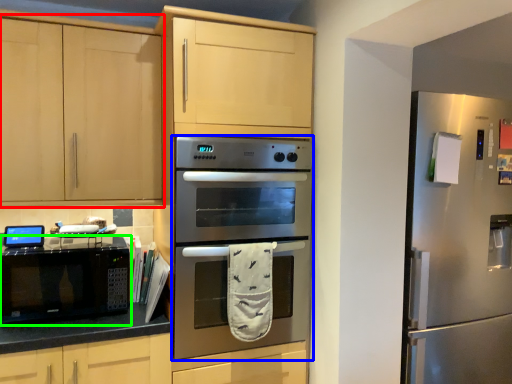
Question: Which object is positioned closest to cabinetry (highlighted by a red box)? Select from oven (highlighted by a blue box) and microwave oven (highlighted by a green box).

Choices:
 (A) oven
 (B) microwave oven

Answer: (B)